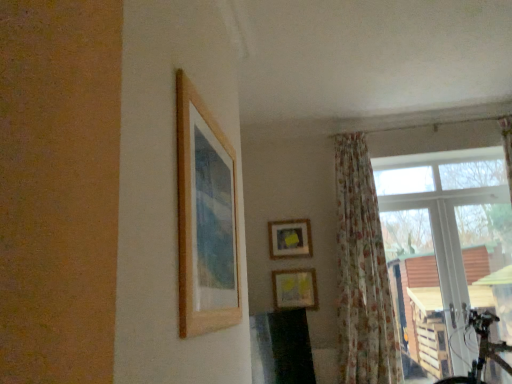
Question: Is the depth of transparent glass window at right greater than that of wooden picture frame at upper left, placed as the first picture frame when sorted from top to bottom?

Choices:
 (A) yes
 (B) no

Answer: (A)

Question: Would you say transparent glass window at right is outside wooden picture frame at upper left, positioned as the 3th picture frame in bottom-to-top order?

Choices:
 (A) no
 (B) yes

Answer: (B)

Question: Does transparent glass window at right have a greater width compared to wooden picture frame at upper left, positioned as the 3th picture frame in bottom-to-top order?

Choices:
 (A) yes
 (B) no

Answer: (A)

Question: Does transparent glass window at right have a greater height compared to wooden picture frame at upper left, positioned as the 3th picture frame in bottom-to-top order?

Choices:
 (A) yes
 (B) no

Answer: (A)

Question: Is transparent glass window at right turned away from wooden picture frame at upper left, positioned as the 3th picture frame in bottom-to-top order?

Choices:
 (A) yes
 (B) no

Answer: (B)

Question: Does transparent glass window at right lie in front of wooden picture frame at upper left, the first picture frame in the front-to-back sequence?

Choices:
 (A) yes
 (B) no

Answer: (B)

Question: Is wooden picture frame at upper left, which is the 3th picture frame in back-to-front order, bigger than matte wooden picture frame at center, which is counted as the third picture frame, starting from the top?

Choices:
 (A) no
 (B) yes

Answer: (B)

Question: From the image's perspective, would you say wooden picture frame at upper left, which is the 3th picture frame in back-to-front order, is positioned over matte wooden picture frame at center, which is counted as the 2th picture frame, starting from the back?

Choices:
 (A) yes
 (B) no

Answer: (A)

Question: Is wooden picture frame at upper left, placed as the first picture frame when sorted from top to bottom, at the right side of matte wooden picture frame at center, which is counted as the 2th picture frame, starting from the back?

Choices:
 (A) yes
 (B) no

Answer: (B)

Question: Is the position of wooden picture frame at upper left, which is the 3th picture frame in back-to-front order, less distant than that of matte wooden picture frame at center, which is counted as the third picture frame, starting from the top?

Choices:
 (A) no
 (B) yes

Answer: (B)

Question: From a real-world perspective, is wooden picture frame at upper left, placed as the first picture frame when sorted from top to bottom, physically below matte wooden picture frame at center, the 1th picture frame ordered from the bottom?

Choices:
 (A) no
 (B) yes

Answer: (A)

Question: Is wooden picture frame at upper left, placed as the first picture frame when sorted from top to bottom, positioned beyond the bounds of matte wooden picture frame at center, which is counted as the 2th picture frame, starting from the back?

Choices:
 (A) yes
 (B) no

Answer: (A)

Question: Is wooden picture frame at upper left, the first picture frame in the front-to-back sequence, bigger than floral fabric curtain at right?

Choices:
 (A) yes
 (B) no

Answer: (B)